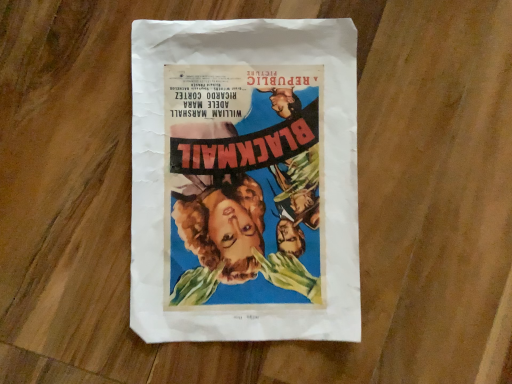
Question: Should I look upward or downward to see vintage paper poster at center?

Choices:
 (A) up
 (B) down

Answer: (A)